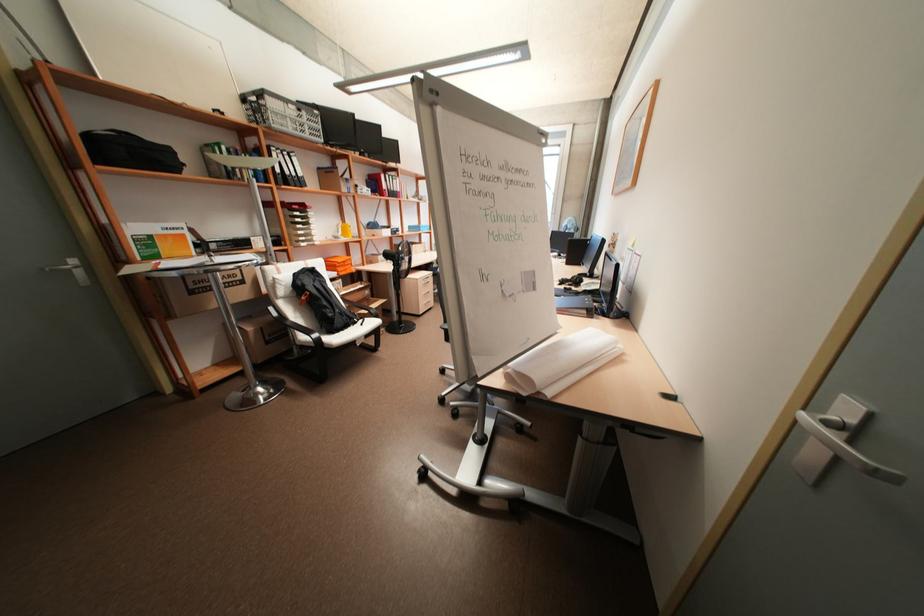
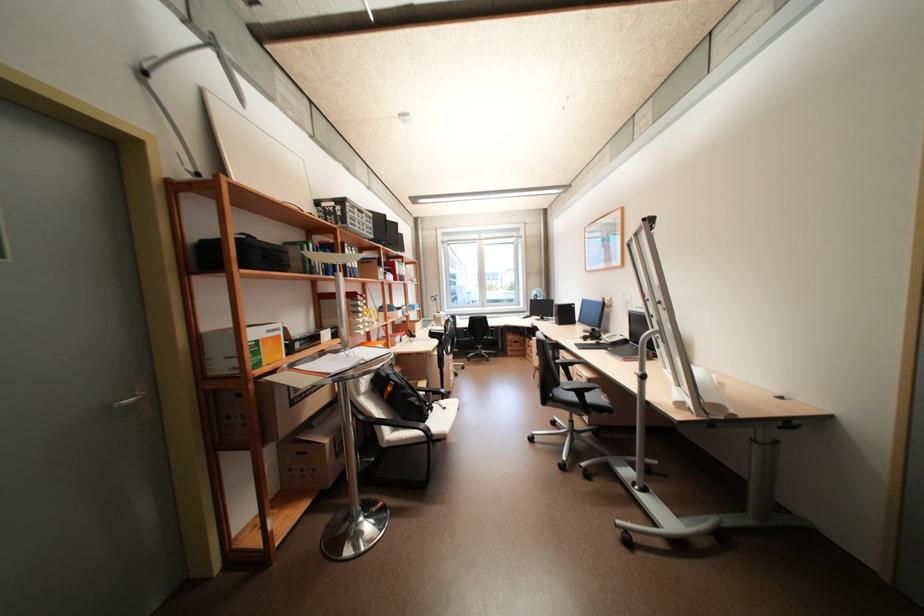
Locate, in the second image, the point that corresponds to point 336,315 in the first image.

(423, 403)